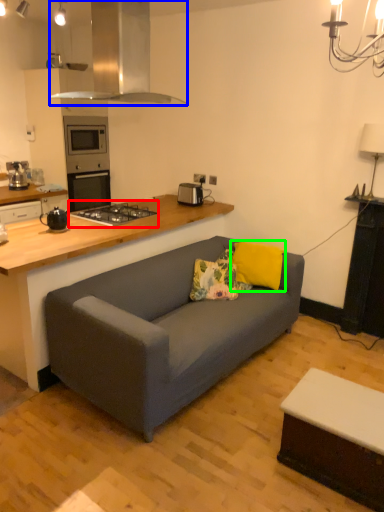
Question: Estimate the real-world distances between objects in this image. Which object is farther from gas stove (highlighted by a red box), kitchen appliance (highlighted by a blue box) or pillow (highlighted by a green box)?

Choices:
 (A) kitchen appliance
 (B) pillow

Answer: (A)